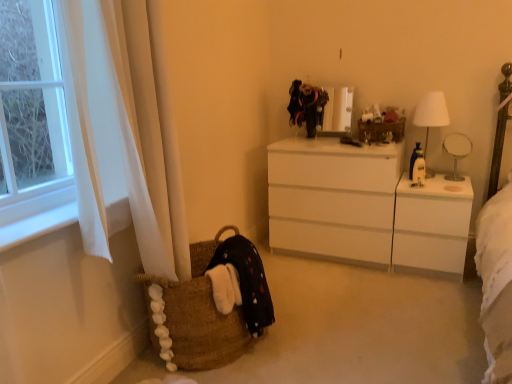
Question: Is brown woven basket at lower left bigger or smaller than white glossy changing table at right?

Choices:
 (A) big
 (B) small

Answer: (B)

Question: Is brown woven basket at lower left taller or shorter than white glossy changing table at right?

Choices:
 (A) tall
 (B) short

Answer: (B)

Question: Estimate the real-world distances between objects in this image. Which object is farther from the white fabric lampshade at right?

Choices:
 (A) brown woven basket at lower left
 (B) white fabric at left
 (C) wooden basket at center
 (D) velvet black dress at upper center, which is the 1th clothing in back-to-front order
 (E) white glossy chest of drawers at center

Answer: (B)

Question: Which object is positioned farthest from the white glossy table lamp at right?

Choices:
 (A) brown woven basket at lower left
 (B) black cotton dress at lower left, which is the second clothing in right-to-left order
 (C) white glossy chest of drawers at center
 (D) white fabric at left
 (E) velvet black dress at upper center, which is the 1th clothing in back-to-front order

Answer: (D)